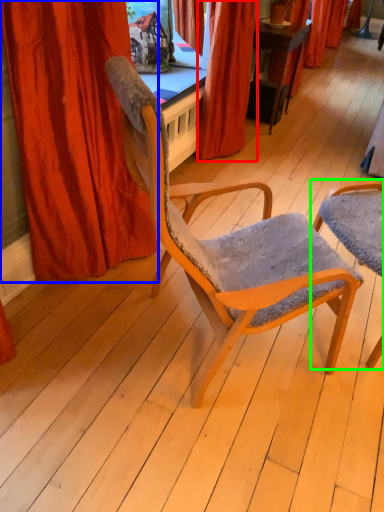
Question: Based on their relative distances, which object is nearer to curtain (highlighted by a red box)? Choose from curtain (highlighted by a blue box) and chair (highlighted by a green box).

Choices:
 (A) curtain
 (B) chair

Answer: (B)